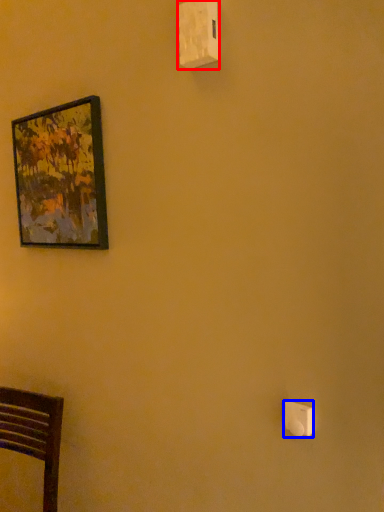
Question: Which point is closer to the camera, light switch (highlighted by a red box) or light switch (highlighted by a blue box)?

Choices:
 (A) light switch
 (B) light switch

Answer: (B)